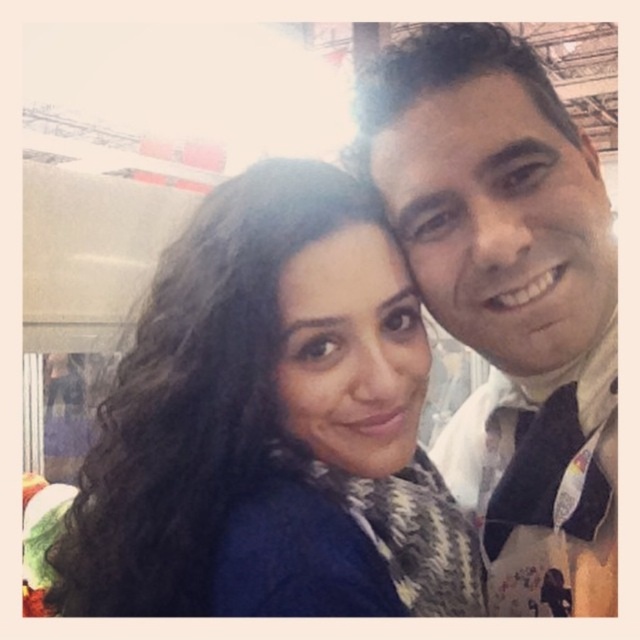
Between dark blue sweater at center and white textured scarf at right, which one has more height?

white textured scarf at right is taller.

Is point (362, 268) positioned after point (442, 298)?

No, it is not.

In order to click on dark blue sweater at center in this screenshot , I will do `click(268, 416)`.